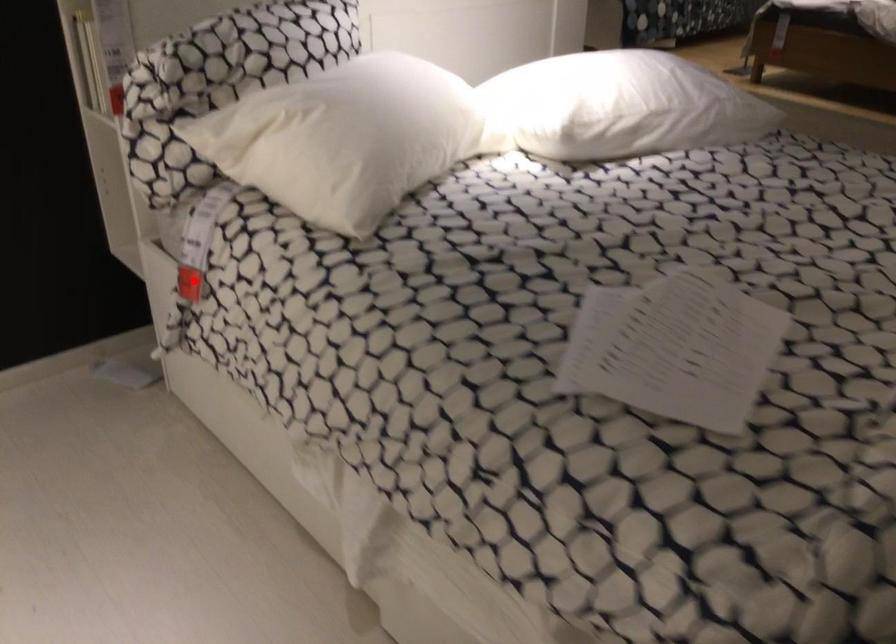
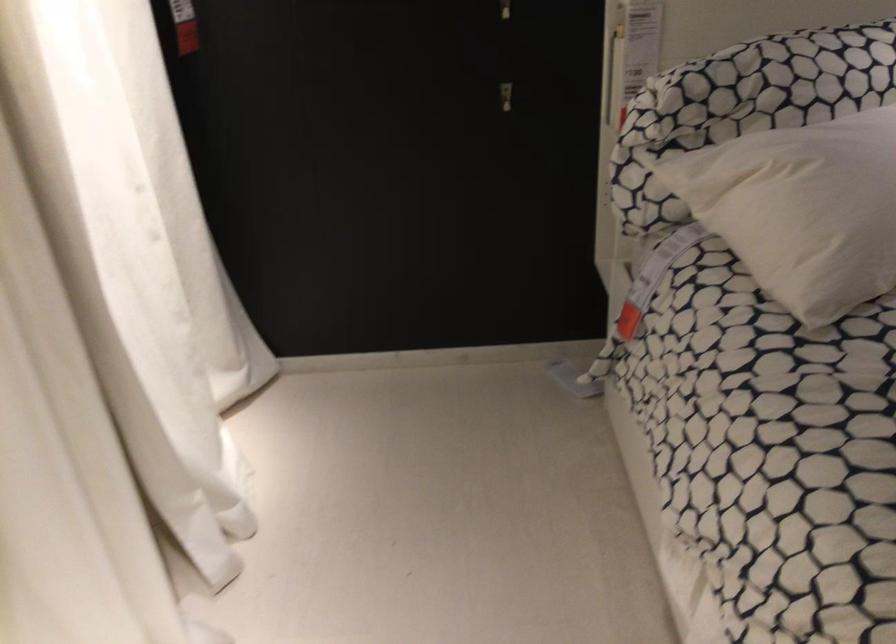
The point at the highlighted location is marked in the first image. Where is the corresponding point in the second image?

(627, 321)